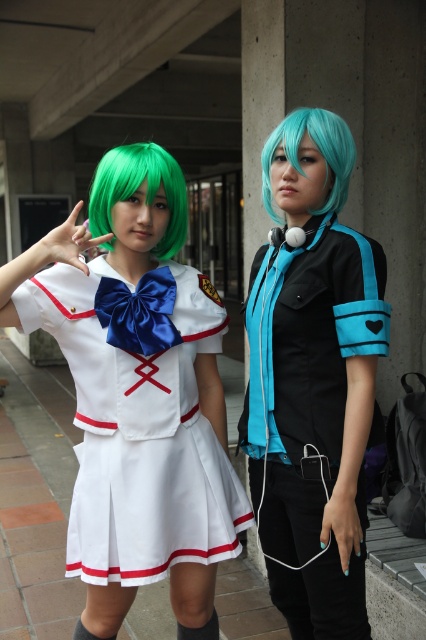
You are trying to locate the matte black shirt at center in the image. Based on the coordinates provided in the Objects Description, can you determine its position relative to the center of the image?

The matte black shirt at center is located at coordinates approximately 59.4 percent from the left edge and 73.7 percent from the top edge of the image, which places it slightly to the right and below the exact center point.